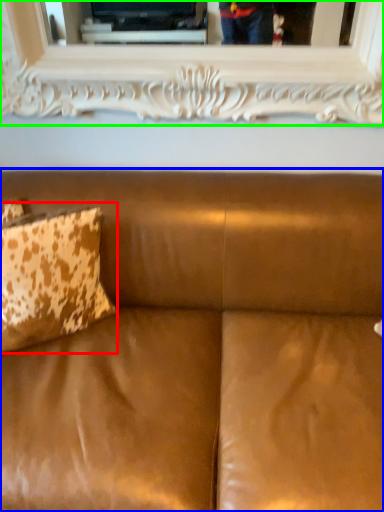
Question: Which object is the farthest from pillow (highlighted by a red box)? Choose among these: studio couch (highlighted by a blue box) or picture frame (highlighted by a green box).

Choices:
 (A) studio couch
 (B) picture frame

Answer: (B)